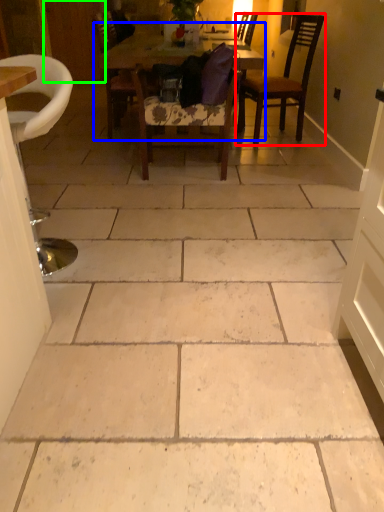
Question: Estimate the real-world distances between objects in this image. Which object is farther from chair (highlighted by a red box), kitchen & dining room table (highlighted by a blue box) or door (highlighted by a green box)?

Choices:
 (A) kitchen & dining room table
 (B) door

Answer: (B)